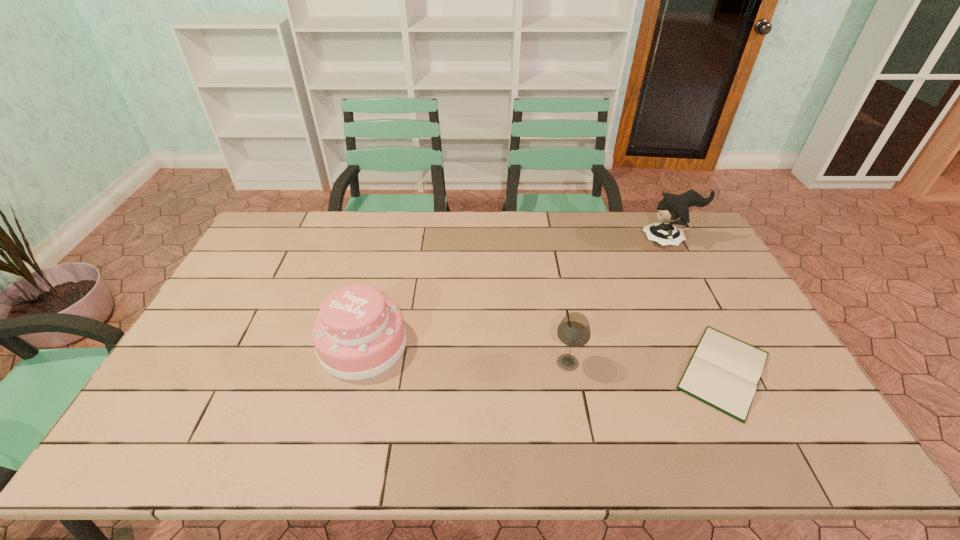
The image size is (960, 540). I want to click on vacant area that lies between the shortest object and the farthest object, so click(x=697, y=306).

Where is `free space between the shortest object and the wineglass`? This screenshot has width=960, height=540. free space between the shortest object and the wineglass is located at coordinates (646, 367).

This screenshot has height=540, width=960. Identify the location of blank region between the second object from left to right and the hardback book. coord(646,367).

I want to click on vacant area that lies between the farthest object and the shortest object, so click(x=697, y=306).

Identify the location of free point between the second object from left to right and the doll. The height and width of the screenshot is (540, 960). (618, 302).

You are a GUI agent. You are given a task and a screenshot of the screen. Output one action in this format:
    pyautogui.click(x=<x>, y=<y>)
    Task: Click on the empty space that is in between the leftmost object and the doll
    
    Given the screenshot: What is the action you would take?
    pyautogui.click(x=516, y=293)

Find the location of a particular element. The width and height of the screenshot is (960, 540). free spot between the leftmost object and the shortest object is located at coordinates (543, 357).

The image size is (960, 540). I want to click on vacant space that's between the shortest object and the wineglass, so click(x=646, y=367).

Where is `object that stands as the third closest to the wineglass`? object that stands as the third closest to the wineglass is located at coordinates (674, 209).

Identify which object is located as the third nearest to the farthest object. Please provide its 2D coordinates. Your answer should be formatted as a tuple, i.e. [(x, y)], where the tuple contains the x and y coordinates of a point satisfying the conditions above.

[(359, 333)]